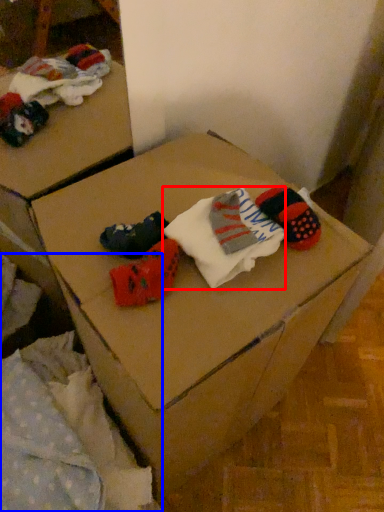
Question: Among these objects, which one is nearest to the camera, sock (highlighted by a red box) or bedding (highlighted by a blue box)?

Choices:
 (A) sock
 (B) bedding

Answer: (B)